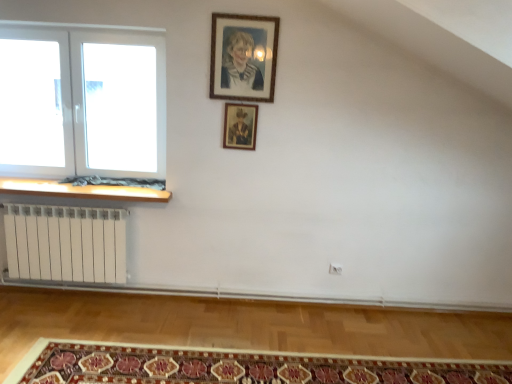
Question: Does wooden at left lie behind wooden picture frame at upper center, which appears as the second picture frame when viewed from the front?

Choices:
 (A) yes
 (B) no

Answer: (A)

Question: From the image's perspective, is wooden at left on wooden picture frame at upper center, which appears as the second picture frame when viewed from the front?

Choices:
 (A) no
 (B) yes

Answer: (A)

Question: Is wooden at left looking in the opposite direction of wooden picture frame at upper center, which is the first picture frame from bottom to top?

Choices:
 (A) no
 (B) yes

Answer: (A)

Question: From a real-world perspective, is wooden at left over wooden picture frame at upper center, the 1th picture frame positioned from the back?

Choices:
 (A) yes
 (B) no

Answer: (B)

Question: Is wooden at left bigger than wooden picture frame at upper center, which appears as the second picture frame when viewed from the front?

Choices:
 (A) yes
 (B) no

Answer: (A)

Question: In terms of size, does wooden picture frame at upper center, the 2th picture frame when ordered from back to front, appear bigger or smaller than wooden picture frame at upper center, which is the first picture frame from bottom to top?

Choices:
 (A) big
 (B) small

Answer: (A)

Question: Considering the positions of point (276, 31) and point (230, 135), is point (276, 31) closer or farther from the camera than point (230, 135)?

Choices:
 (A) farther
 (B) closer

Answer: (B)

Question: Is wooden picture frame at upper center, which is the 1th picture frame from front to back, to the left or to the right of wooden picture frame at upper center, the 1th picture frame positioned from the back, in the image?

Choices:
 (A) left
 (B) right

Answer: (B)

Question: Do you think wooden picture frame at upper center, which is the first picture frame in top-to-bottom order, is within wooden picture frame at upper center, the 1th picture frame positioned from the back, or outside of it?

Choices:
 (A) outside
 (B) inside

Answer: (A)

Question: Is wooden at left wider or thinner than wooden picture frame at upper center, which appears as the second picture frame when viewed from the front?

Choices:
 (A) wide
 (B) thin

Answer: (A)

Question: Is wooden at left inside the boundaries of wooden picture frame at upper center, the 1th picture frame positioned from the back, or outside?

Choices:
 (A) outside
 (B) inside

Answer: (A)

Question: Looking at the image, does wooden at left seem bigger or smaller compared to wooden picture frame at upper center, which is the first picture frame from bottom to top?

Choices:
 (A) small
 (B) big

Answer: (B)

Question: From the image's perspective, is wooden at left above or below wooden picture frame at upper center, which is the first picture frame from bottom to top?

Choices:
 (A) above
 (B) below

Answer: (B)

Question: Considering the positions of wooden picture frame at upper center, positioned as the 2th picture frame in top-to-bottom order, and carpeted mat at lower center in the image, is wooden picture frame at upper center, positioned as the 2th picture frame in top-to-bottom order, bigger or smaller than carpeted mat at lower center?

Choices:
 (A) big
 (B) small

Answer: (B)

Question: Based on their positions, is wooden picture frame at upper center, which appears as the second picture frame when viewed from the front, located to the left or right of carpeted mat at lower center?

Choices:
 (A) right
 (B) left

Answer: (B)